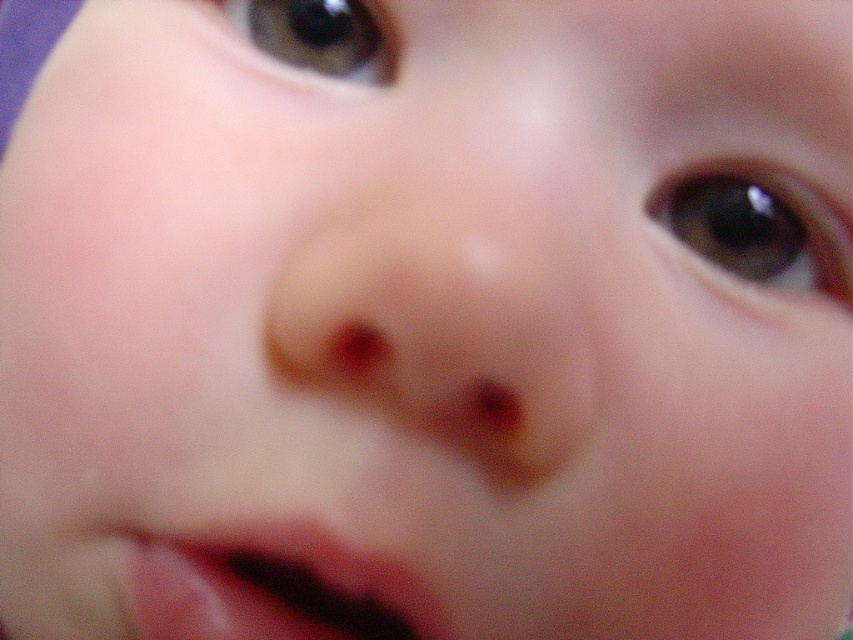
Is pink smooth lips at lower center taller than brown glossy eye at upper left?

Yes, pink smooth lips at lower center is taller than brown glossy eye at upper left.

Looking at this image, can you confirm if pink smooth lips at lower center is positioned to the left of brown glossy eye at upper left?

In fact, pink smooth lips at lower center is to the right of brown glossy eye at upper left.

Which is behind, point (256, 605) or point (387, 42)?

Point (387, 42)

Identify the location of pink smooth lips at lower center. This screenshot has width=853, height=640. (274, 589).

Is pink smooth lips at lower center taller than brown glossy eye at upper right?

No, pink smooth lips at lower center is not taller than brown glossy eye at upper right.

Which is below, pink smooth lips at lower center or brown glossy eye at upper right?

pink smooth lips at lower center is below.

This screenshot has height=640, width=853. Find the location of `pink smooth lips at lower center`. pink smooth lips at lower center is located at coordinates (274, 589).

You are a GUI agent. You are given a task and a screenshot of the screen. Output one action in this format:
    pyautogui.click(x=<x>, y=<y>)
    Task: Click on the pink smooth lips at lower center
    
    Given the screenshot: What is the action you would take?
    pyautogui.click(x=274, y=589)

Locate an element on the screen. This screenshot has width=853, height=640. brown glossy eye at upper right is located at coordinates (758, 225).

Where is `brown glossy eye at upper right`? This screenshot has width=853, height=640. brown glossy eye at upper right is located at coordinates (758, 225).